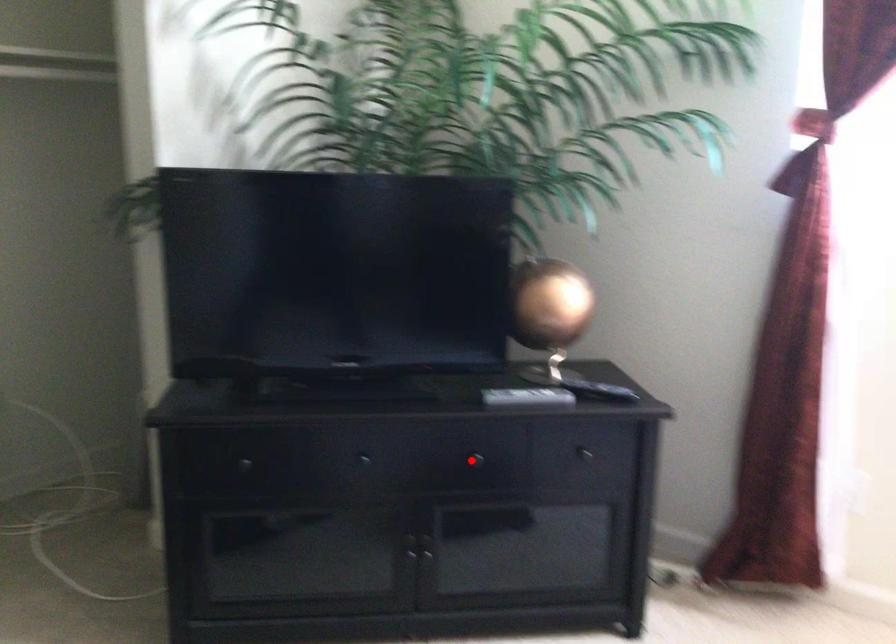
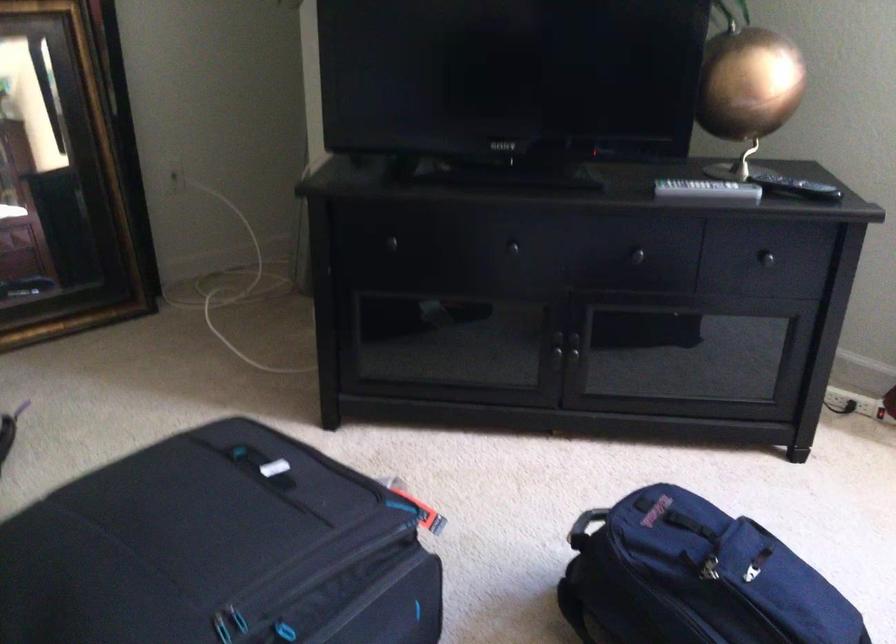
Where in the second image is the point corresponding to the highlighted location from the first image?

(631, 257)